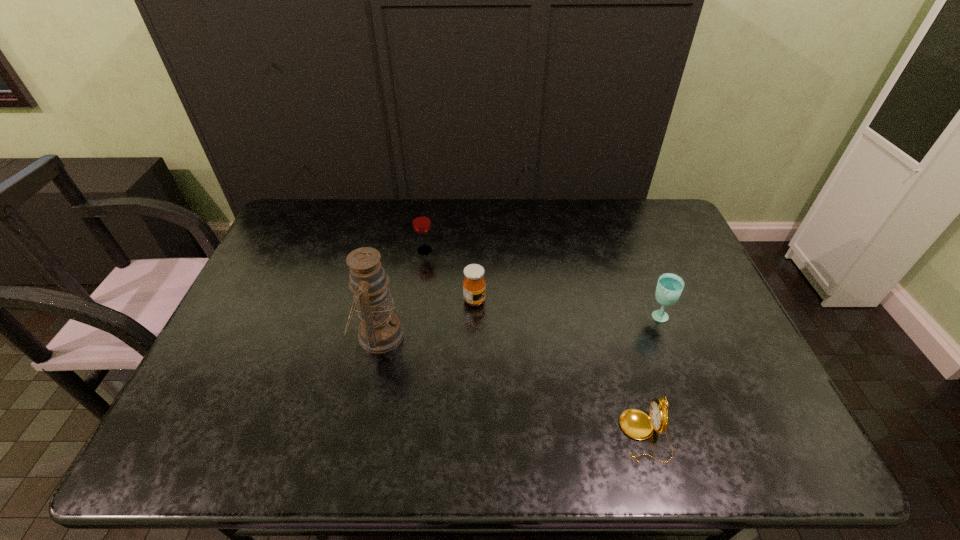
You are a GUI agent. You are given a task and a screenshot of the screen. Output one action in this format:
    pyautogui.click(x=<x>, y=<y>)
    Task: Click on the vacant point located between the farther glass and the right glass
    The width and height of the screenshot is (960, 540).
    Given the screenshot: What is the action you would take?
    pyautogui.click(x=541, y=284)

Find the location of a particular element. vacant space in between the third object from right to left and the nearer glass is located at coordinates (566, 308).

Identify which object is the second closest to the tallest object. Please provide its 2D coordinates. Your answer should be formatted as a tuple, i.e. [(x, y)], where the tuple contains the x and y coordinates of a point satisfying the conditions above.

[(421, 221)]

The width and height of the screenshot is (960, 540). What are the coordinates of `object that stands as the second closest to the tallest object` in the screenshot? It's located at (421, 221).

Find the location of a particular element. The width and height of the screenshot is (960, 540). vacant point that satisfies the following two spatial constraints: 1. on the front-facing side of the honey; 2. on the left side of the right glass is located at coordinates (474, 317).

Image resolution: width=960 pixels, height=540 pixels. What are the coordinates of `free space that satisfies the following two spatial constraints: 1. on the front side of the rightmost object; 2. on the face of the pocket watch` in the screenshot? It's located at (703, 435).